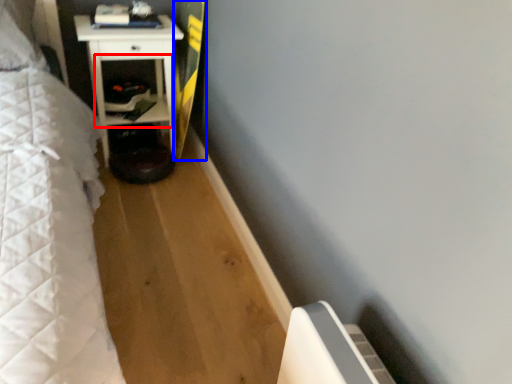
Question: Which of the following is the closest to the observer, shelf (highlighted by a red box) or longboard (highlighted by a blue box)?

Choices:
 (A) shelf
 (B) longboard

Answer: (B)